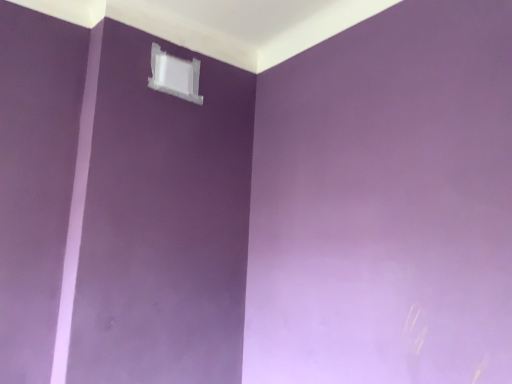
The image size is (512, 384). What do you see at coordinates (175, 75) in the screenshot?
I see `white plastic window at upper center` at bounding box center [175, 75].

Identify the location of white plastic window at upper center. The image size is (512, 384). (x=175, y=75).

Find the location of a particular element. This screenshot has height=384, width=512. white plastic window at upper center is located at coordinates (175, 75).